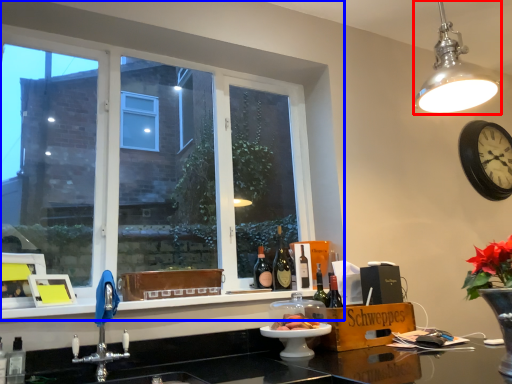
Question: Which of the following is the closest to the observer, light fixture (highlighted by a red box) or window (highlighted by a blue box)?

Choices:
 (A) light fixture
 (B) window

Answer: (A)